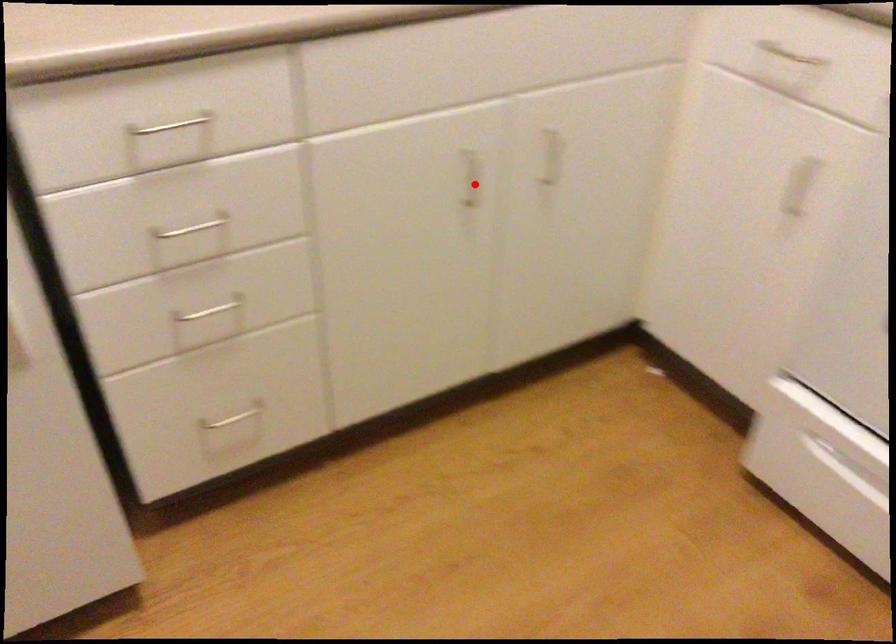
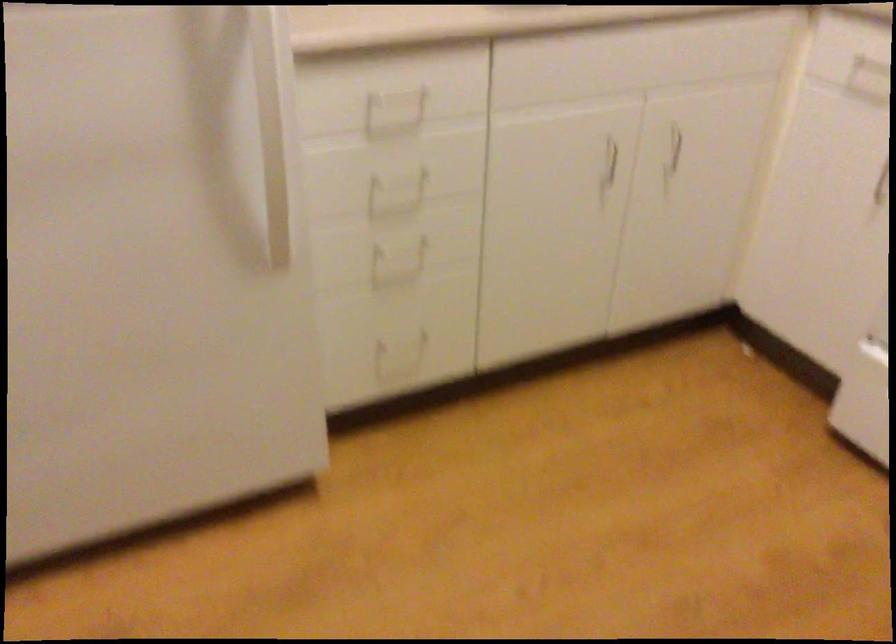
Question: I am providing you with two images of the same scene from different viewpoints. A red point is marked on the first image. At the location where the point appears in image 1, is it still visible in image 2?

Choices:
 (A) Yes
 (B) No

Answer: (A)